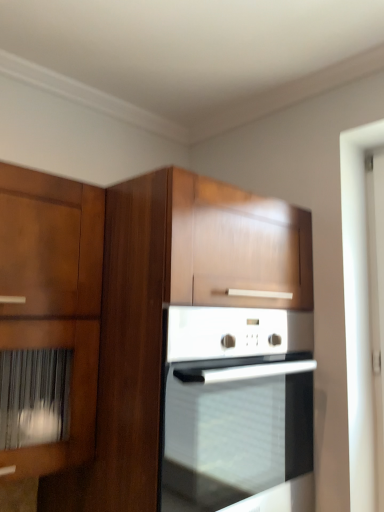
Question: Should I look upward or downward to see white glossy screen door at right?

Choices:
 (A) up
 (B) down

Answer: (B)

Question: Can you confirm if white glossy oven at center is shorter than wooden cabinet at center?

Choices:
 (A) no
 (B) yes

Answer: (B)

Question: Is wooden cabinet at center surrounded by white glossy oven at center?

Choices:
 (A) no
 (B) yes

Answer: (B)

Question: Is white glossy oven at center closer to camera compared to wooden cabinet at center?

Choices:
 (A) yes
 (B) no

Answer: (B)

Question: Does white glossy oven at center have a lesser width compared to wooden cabinet at center?

Choices:
 (A) no
 (B) yes

Answer: (A)

Question: Is white glossy oven at center to the right of wooden cabinet at center from the viewer's perspective?

Choices:
 (A) no
 (B) yes

Answer: (B)

Question: From the image's perspective, is white glossy oven at center over wooden cabinet at center?

Choices:
 (A) no
 (B) yes

Answer: (A)

Question: Is white glossy screen door at right in front of white glossy oven at center?

Choices:
 (A) no
 (B) yes

Answer: (A)

Question: From the image's perspective, does white glossy screen door at right appear higher than white glossy oven at center?

Choices:
 (A) no
 (B) yes

Answer: (B)

Question: Is white glossy screen door at right surrounding white glossy oven at center?

Choices:
 (A) yes
 (B) no

Answer: (B)

Question: Does white glossy screen door at right touch white glossy oven at center?

Choices:
 (A) no
 (B) yes

Answer: (A)

Question: Is white glossy screen door at right taller than white glossy oven at center?

Choices:
 (A) no
 (B) yes

Answer: (B)

Question: Is white glossy screen door at right wider than white glossy oven at center?

Choices:
 (A) no
 (B) yes

Answer: (A)

Question: Can you confirm if wooden cabinet at center is positioned to the left of white glossy screen door at right?

Choices:
 (A) no
 (B) yes

Answer: (B)